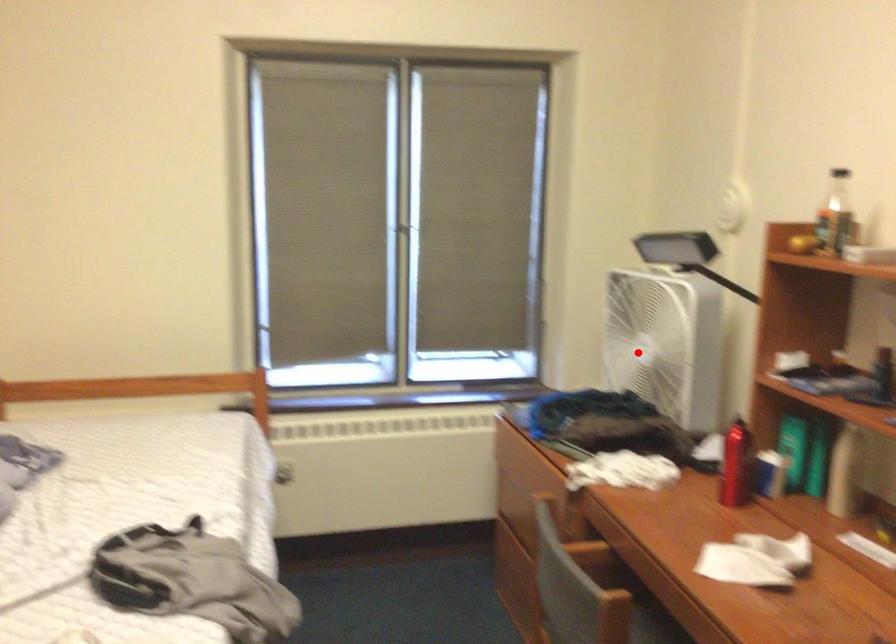
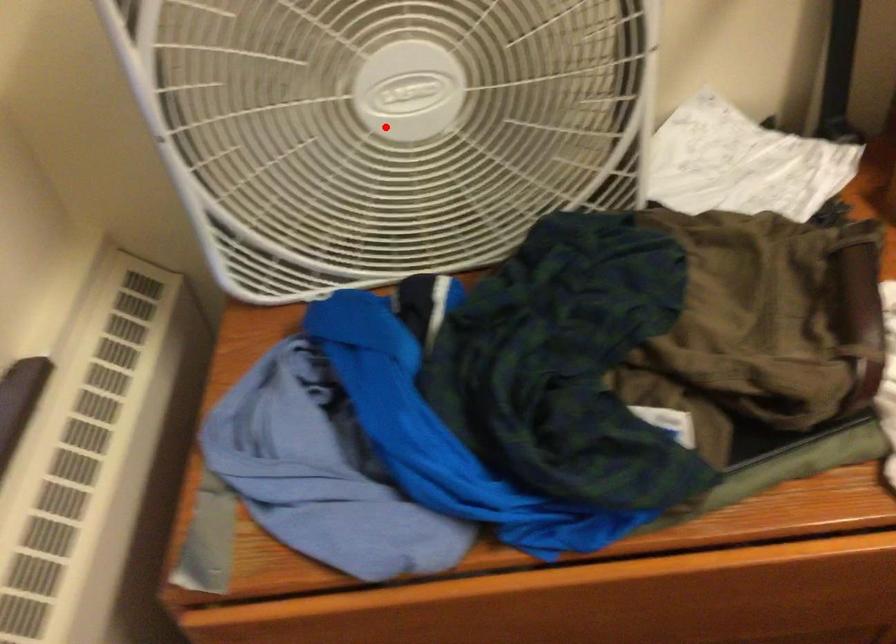
I am providing you with two images of the same scene from different viewpoints. A red point is marked on the first image and another point is marked on the second image. Do the highlighted points in image1 and image2 indicate the same real-world spot?

Yes